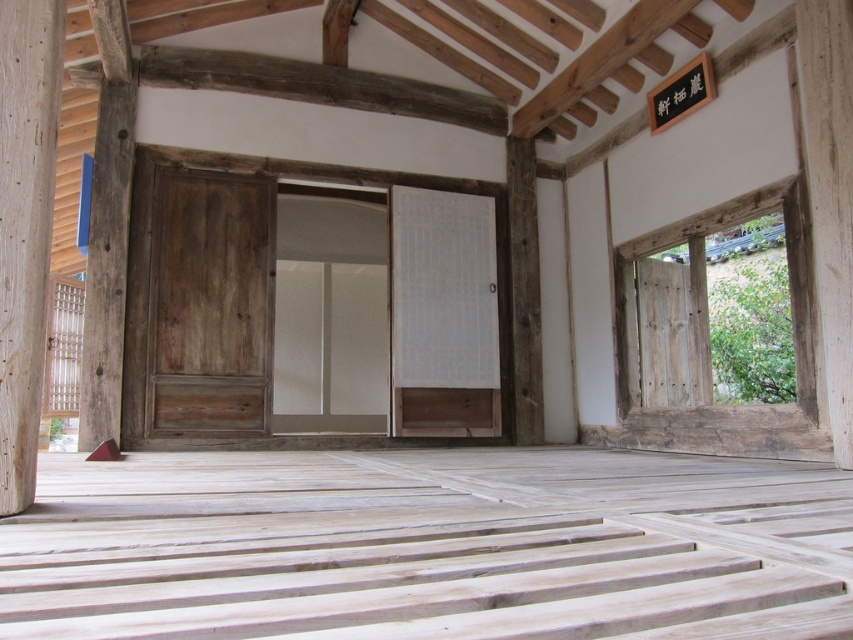
Is natural wood pillar at left further to the viewer compared to wooden post at center?

No, it is in front of wooden post at center.

Does natural wood pillar at left appear on the right side of wooden post at center?

In fact, natural wood pillar at left is to the left of wooden post at center.

Locate an element on the screen. natural wood pillar at left is located at coordinates (25, 227).